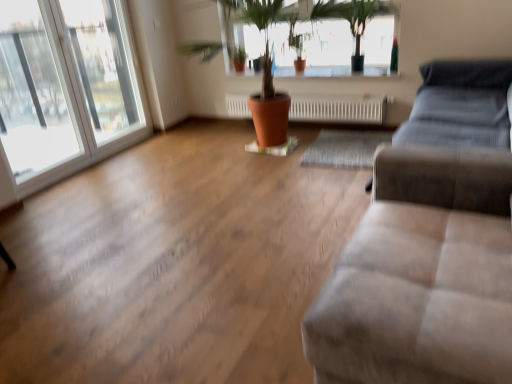
Question: Can we say transparent glass window at left, positioned as the second window in left-to-right order, lies outside green leafy plant at upper center?

Choices:
 (A) no
 (B) yes

Answer: (B)

Question: Considering the relative sizes of transparent glass window at left, placed as the first window when sorted from right to left, and green leafy plant at upper center in the image provided, is transparent glass window at left, placed as the first window when sorted from right to left, shorter than green leafy plant at upper center?

Choices:
 (A) no
 (B) yes

Answer: (A)

Question: Is green leafy plant at upper center inside transparent glass window at left, placed as the first window when sorted from right to left?

Choices:
 (A) no
 (B) yes

Answer: (A)

Question: Is transparent glass window at left, positioned as the second window in left-to-right order, to the left of green leafy plant at upper center from the viewer's perspective?

Choices:
 (A) yes
 (B) no

Answer: (A)

Question: From the image's perspective, would you say transparent glass window at left, positioned as the second window in left-to-right order, is shown under green leafy plant at upper center?

Choices:
 (A) no
 (B) yes

Answer: (B)

Question: Considering the relative sizes of transparent glass window at left, positioned as the second window in left-to-right order, and green leafy plant at upper center in the image provided, is transparent glass window at left, positioned as the second window in left-to-right order, bigger than green leafy plant at upper center?

Choices:
 (A) no
 (B) yes

Answer: (A)

Question: Is suede-like beige couch at lower right oriented away from white textured radiator at center?

Choices:
 (A) no
 (B) yes

Answer: (A)

Question: From the image's perspective, is suede-like beige couch at lower right above white textured radiator at center?

Choices:
 (A) no
 (B) yes

Answer: (A)

Question: Is the position of suede-like beige couch at lower right less distant than that of white textured radiator at center?

Choices:
 (A) yes
 (B) no

Answer: (A)

Question: From a real-world perspective, is suede-like beige couch at lower right physically above white textured radiator at center?

Choices:
 (A) yes
 (B) no

Answer: (A)

Question: Is suede-like beige couch at lower right outside of white textured radiator at center?

Choices:
 (A) yes
 (B) no

Answer: (A)

Question: Considering the relative sizes of suede-like beige couch at lower right and white textured radiator at center in the image provided, is suede-like beige couch at lower right thinner than white textured radiator at center?

Choices:
 (A) yes
 (B) no

Answer: (B)

Question: Is transparent glass window at left, positioned as the second window in left-to-right order, shorter than transparent glass window at left, the 2th window viewed from the right?

Choices:
 (A) yes
 (B) no

Answer: (A)